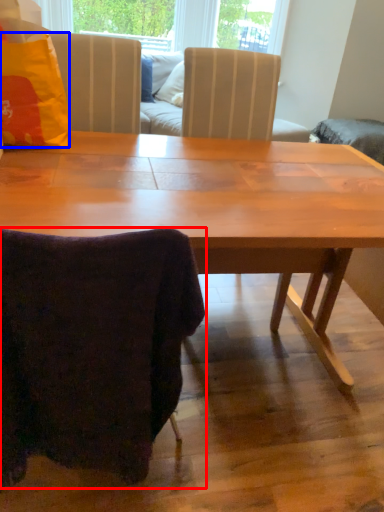
Question: Which object is further to the camera taking this photo, chair (highlighted by a red box) or pillow (highlighted by a blue box)?

Choices:
 (A) chair
 (B) pillow

Answer: (B)